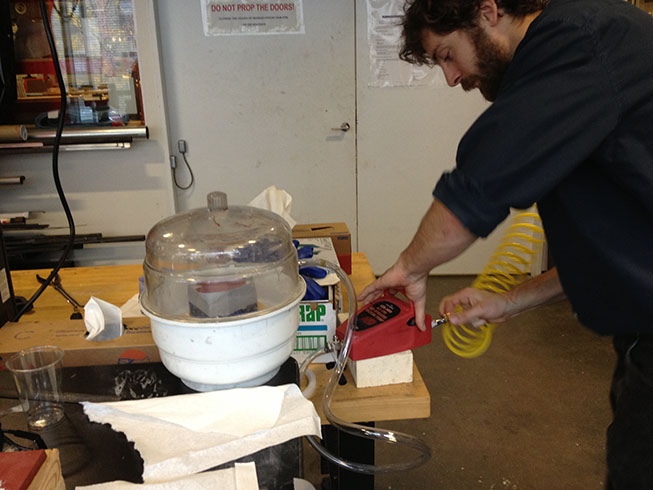
Find the location of a particular element. cup is located at coordinates (40, 380).